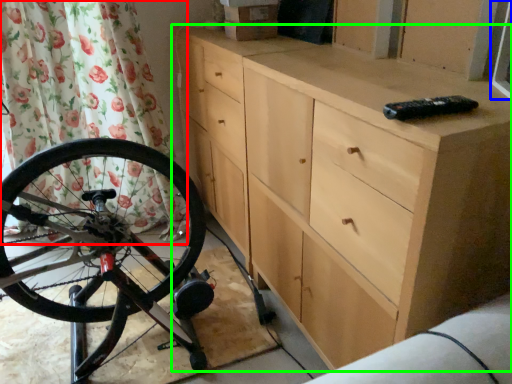
Question: Based on their relative distances, which object is nearer to shower curtain (highlighted by a red box)? Choose from window screen (highlighted by a blue box) and chest of drawers (highlighted by a green box).

Choices:
 (A) window screen
 (B) chest of drawers

Answer: (B)